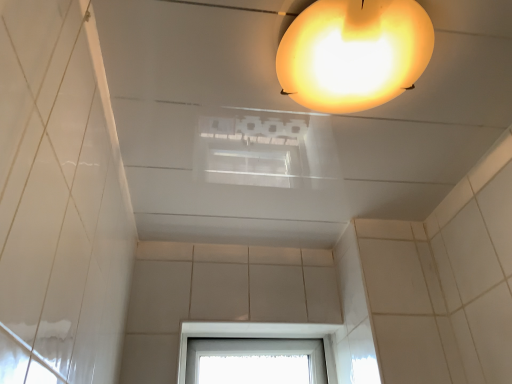
Question: In terms of height, does translucent yellow lampshade at upper center look taller or shorter compared to transparent glass window at lower center?

Choices:
 (A) tall
 (B) short

Answer: (B)

Question: Considering their positions, is translucent yellow lampshade at upper center located in front of or behind transparent glass window at lower center?

Choices:
 (A) front
 (B) behind

Answer: (A)

Question: Considering the positions of translucent yellow lampshade at upper center and transparent glass window at lower center in the image, is translucent yellow lampshade at upper center bigger or smaller than transparent glass window at lower center?

Choices:
 (A) small
 (B) big

Answer: (A)

Question: Is transparent glass window at lower center situated inside translucent yellow lampshade at upper center or outside?

Choices:
 (A) inside
 (B) outside

Answer: (B)

Question: Considering the positions of transparent glass window at lower center and translucent yellow lampshade at upper center in the image, is transparent glass window at lower center wider or thinner than translucent yellow lampshade at upper center?

Choices:
 (A) wide
 (B) thin

Answer: (B)

Question: Is transparent glass window at lower center in front of or behind translucent yellow lampshade at upper center in the image?

Choices:
 (A) behind
 (B) front

Answer: (A)

Question: Looking at the image, does transparent glass window at lower center seem bigger or smaller compared to translucent yellow lampshade at upper center?

Choices:
 (A) big
 (B) small

Answer: (A)